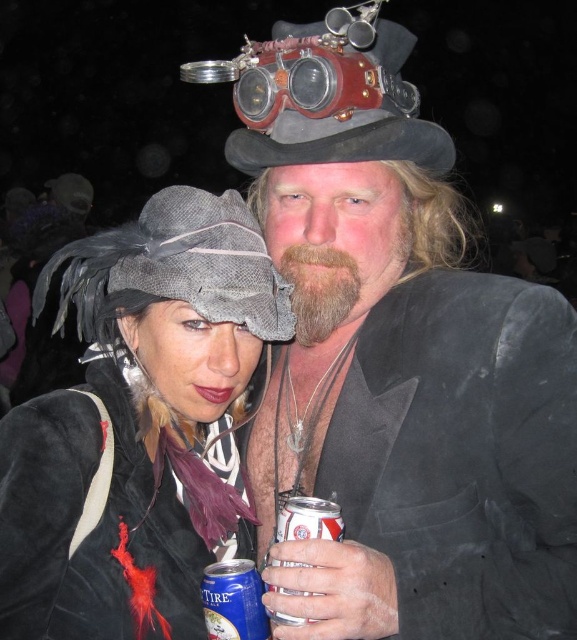
Is velvet black suit at center smaller than blue metallic can at lower center?

Incorrect, velvet black suit at center is not smaller in size than blue metallic can at lower center.

At what (x,y) coordinates should I click in order to perform the action: click on velvet black suit at center. Please return your answer as a coordinate pair (x, y). The height and width of the screenshot is (640, 577). Looking at the image, I should click on (413, 401).

This screenshot has height=640, width=577. Describe the element at coordinates (136, 422) in the screenshot. I see `felt hat at upper left` at that location.

Is felt hat at upper left taller than brown fuzzy beard at center?

Indeed, felt hat at upper left has a greater height compared to brown fuzzy beard at center.

Locate an element on the screen. The height and width of the screenshot is (640, 577). felt hat at upper left is located at coordinates point(136,422).

Between felt hat at upper left and blue metallic can at lower center, which one is positioned lower?

blue metallic can at lower center

Does point (159, 435) lie behind point (340, 524)?

That is True.

Where is `felt hat at upper left`? The image size is (577, 640). felt hat at upper left is located at coordinates coord(136,422).